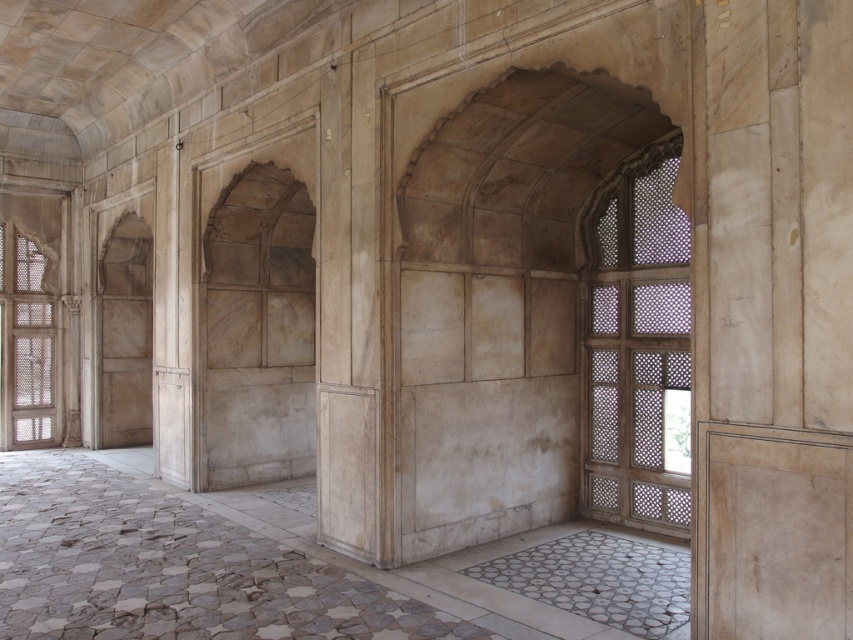
Question: Can you confirm if translucent wood lattice at right is bigger than matte wood window at left?

Choices:
 (A) yes
 (B) no

Answer: (A)

Question: Is translucent wood lattice at right positioned behind matte wood window at left?

Choices:
 (A) yes
 (B) no

Answer: (B)

Question: Which point is closer to the camera?

Choices:
 (A) (656, 493)
 (B) (35, 304)

Answer: (A)

Question: In this image, where is translucent wood lattice at right located relative to matte wood window at left?

Choices:
 (A) above
 (B) below

Answer: (A)